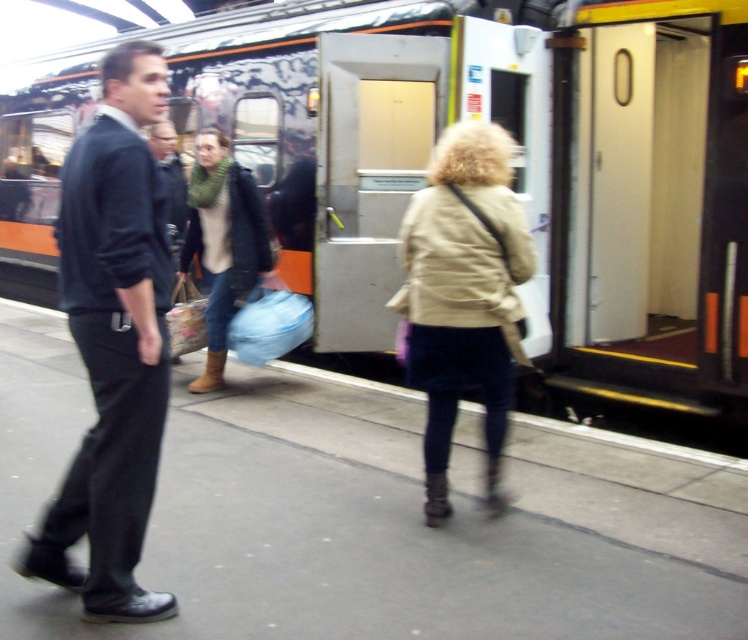
Is beige fabric coat at center shorter than knitted green scarf at center?

Indeed, beige fabric coat at center has a lesser height compared to knitted green scarf at center.

Can you confirm if beige fabric coat at center is smaller than knitted green scarf at center?

Correct, beige fabric coat at center occupies less space than knitted green scarf at center.

Where is `beige fabric coat at center`? This screenshot has width=748, height=640. beige fabric coat at center is located at coordinates (462, 296).

How much distance is there between dark blue suit at left and knitted green scarf at center?

They are 3.08 meters apart.

Which is below, dark blue suit at left or knitted green scarf at center?

Positioned lower is dark blue suit at left.

Identify the location of dark blue suit at left. The width and height of the screenshot is (748, 640). (113, 342).

Which is more to the left, dark blue suit at left or beige fabric coat at center?

dark blue suit at left

Can you confirm if dark blue suit at left is shorter than beige fabric coat at center?

In fact, dark blue suit at left may be taller than beige fabric coat at center.

Is point (64, 304) positioned before point (487, 401)?

That is True.

This screenshot has height=640, width=748. Identify the location of dark blue suit at left. (113, 342).